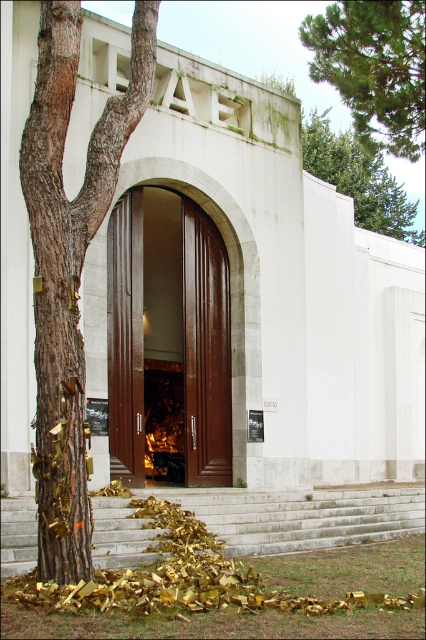
You are a delivery person trying to deliver a package to the building. The door requires a key that must fit into a slot on the side. The slot is as wide as the green pine tree at upper right. Will the key fit into the slot if the key is as wide as the brown wooden door at center?

The brown wooden door at center has a lesser width compared to green pine tree at upper right. Since the key is as wide as the brown wooden door at center, which is narrower than the slot, the key will fit into the slot.

You are a delivery person carrying a large package that is 2 meters wide. You need to approach the brown polished wood door at center. Can you pass through the space between the white stone stairs at center and the building wall without the package hitting the stairs or the wall?

The white stone stairs at center are wider than the brown polished wood door at center. Since the package is 2 meters wide, it may not fit through the narrower door area. However, the stairs are wider, so the package could potentially pass through the stairs area without hitting the wall, but the exact feasibility depends on the specific dimensions of the stairs and door. However, since the stairs are wider than the door, the package might have enough space if aligned correctly.

You are standing at the base of the white stone stairs at center and want to reach the brown polished wood door at center. According to the scene, which direction should you move to get closer to the door?

The white stone stairs at center is below the brown polished wood door at center, so you should move upward along the white stone stairs at center to reach the door.